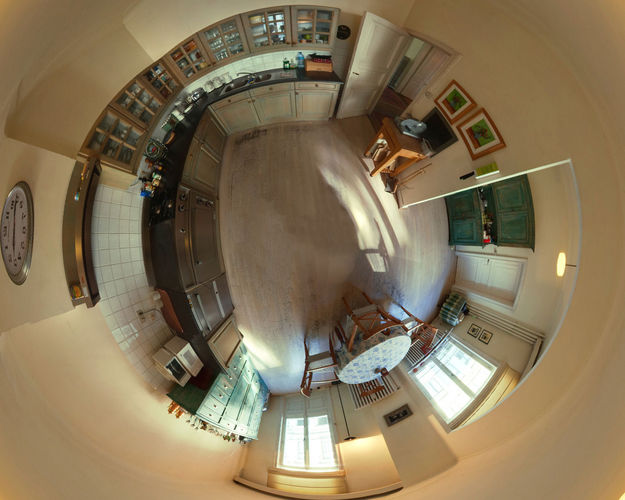
Image resolution: width=625 pixels, height=500 pixels. I want to click on window, so click(x=464, y=394), click(x=314, y=439).